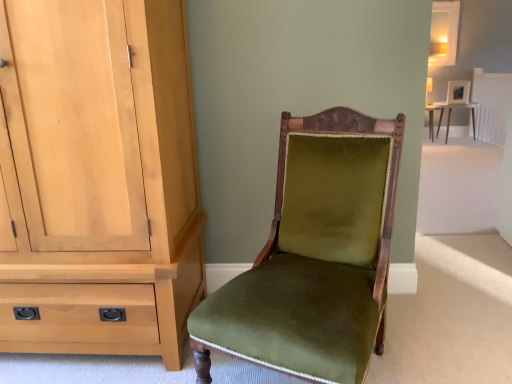
Question: Considering the relative sizes of velvet-green chair at center and matte white table at upper right in the image provided, is velvet-green chair at center taller than matte white table at upper right?

Choices:
 (A) no
 (B) yes

Answer: (B)

Question: Are velvet-green chair at center and matte white table at upper right making contact?

Choices:
 (A) no
 (B) yes

Answer: (A)

Question: Does velvet-green chair at center have a larger size compared to matte white table at upper right?

Choices:
 (A) no
 (B) yes

Answer: (B)

Question: Is the depth of velvet-green chair at center greater than that of matte white table at upper right?

Choices:
 (A) yes
 (B) no

Answer: (B)

Question: From the image's perspective, would you say velvet-green chair at center is shown under matte white table at upper right?

Choices:
 (A) yes
 (B) no

Answer: (A)

Question: Is the position of velvet-green chair at center less distant than that of matte white table at upper right?

Choices:
 (A) yes
 (B) no

Answer: (A)

Question: Does matte white table at upper right have a greater width compared to velvet-green chair at center?

Choices:
 (A) no
 (B) yes

Answer: (A)

Question: From the image's perspective, is matte white table at upper right below velvet-green chair at center?

Choices:
 (A) no
 (B) yes

Answer: (A)

Question: Is velvet-green chair at center at the back of matte white table at upper right?

Choices:
 (A) no
 (B) yes

Answer: (A)

Question: Can you confirm if matte white table at upper right is bigger than velvet-green chair at center?

Choices:
 (A) no
 (B) yes

Answer: (A)

Question: Is matte white table at upper right at the left side of velvet-green chair at center?

Choices:
 (A) no
 (B) yes

Answer: (A)

Question: From a real-world perspective, is matte white table at upper right positioned under velvet-green chair at center based on gravity?

Choices:
 (A) no
 (B) yes

Answer: (B)

Question: Considering the relative sizes of matte white table at upper right and light wood cabinet at left in the image provided, is matte white table at upper right taller than light wood cabinet at left?

Choices:
 (A) no
 (B) yes

Answer: (A)